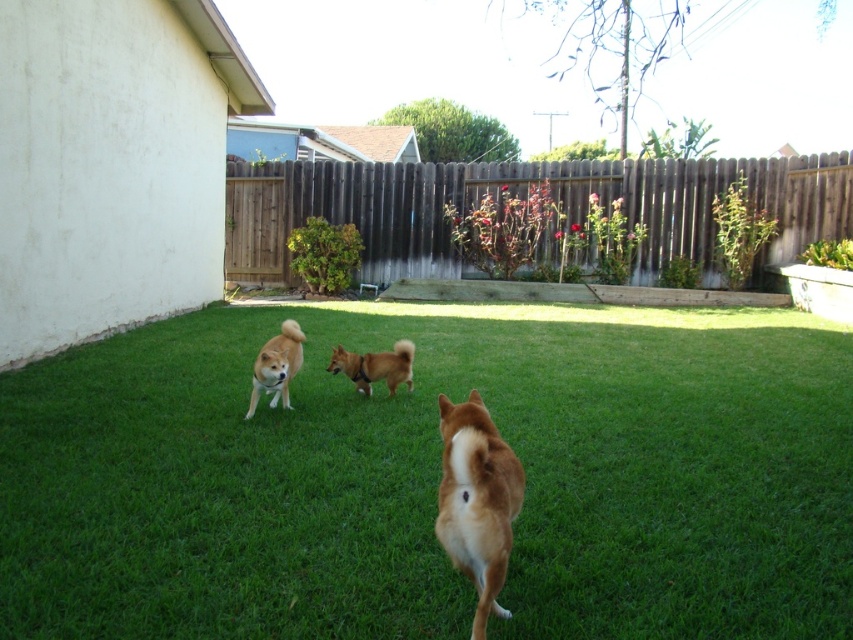
Does brown furry dog at center have a smaller size compared to light brown fur at center?

Yes, brown furry dog at center is smaller than light brown fur at center.

Can you confirm if brown furry dog at center is shorter than light brown fur at center?

No, brown furry dog at center is not shorter than light brown fur at center.

Is point (503, 524) more distant than point (273, 387)?

No, it is not.

Identify the location of brown furry dog at center. (476, 500).

Is point (514, 452) closer to viewer compared to point (358, 371)?

Yes, it is.

Locate an element on the screen. brown furry dog at center is located at coordinates (476, 500).

Is point (503, 552) closer to viewer compared to point (358, 374)?

That is True.

Locate an element on the screen. This screenshot has width=853, height=640. brown furry dog at center is located at coordinates (476, 500).

Who is positioned more to the right, light brown fur at center or brown fur dog at center?

brown fur dog at center is more to the right.

Does light brown fur at center have a greater width compared to brown fur dog at center?

In fact, light brown fur at center might be narrower than brown fur dog at center.

Image resolution: width=853 pixels, height=640 pixels. Find the location of `light brown fur at center`. light brown fur at center is located at coordinates (276, 365).